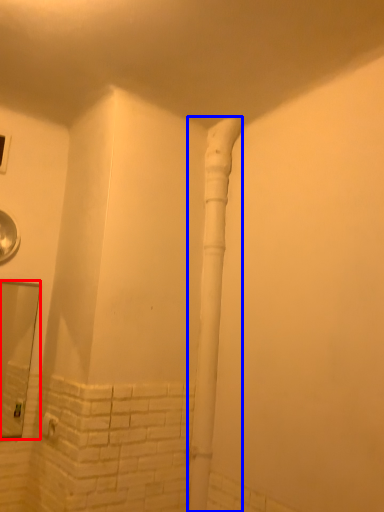
Question: Which point is closer to the camera, mirror (highlighted by a red box) or water pipe (highlighted by a blue box)?

Choices:
 (A) mirror
 (B) water pipe

Answer: (B)